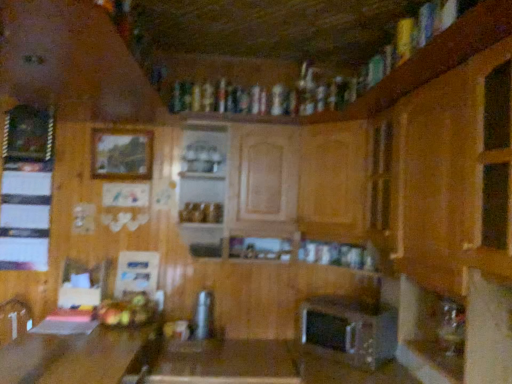
Question: Which direction should I rotate to look at wooden table at center, marked as the 1th table in a right-to-left arrangement, — up or down?

Choices:
 (A) down
 (B) up

Answer: (A)

Question: Is the surface of wooden picture frame at upper left, which is the second picture frame in left-to-right order, in direct contact with wooden table at lower left, which is the first table from left to right?

Choices:
 (A) no
 (B) yes

Answer: (A)

Question: Does wooden picture frame at upper left, which is the second picture frame in left-to-right order, turn towards wooden table at lower left, which ranks as the second table in right-to-left order?

Choices:
 (A) yes
 (B) no

Answer: (B)

Question: Can you confirm if wooden picture frame at upper left, the first picture frame in the right-to-left sequence, is shorter than wooden table at lower left, which is the first table from left to right?

Choices:
 (A) yes
 (B) no

Answer: (A)

Question: Does wooden picture frame at upper left, which is the second picture frame in left-to-right order, appear on the right side of wooden table at lower left, which ranks as the second table in right-to-left order?

Choices:
 (A) yes
 (B) no

Answer: (A)

Question: From the image's perspective, does wooden picture frame at upper left, the first picture frame in the right-to-left sequence, appear higher than wooden table at lower left, which is the first table from left to right?

Choices:
 (A) no
 (B) yes

Answer: (B)

Question: From a real-world perspective, is wooden picture frame at upper left, which is the second picture frame in left-to-right order, positioned over wooden table at lower left, which ranks as the second table in right-to-left order, based on gravity?

Choices:
 (A) yes
 (B) no

Answer: (A)

Question: Would you say satin silver toaster at lower center, marked as the 2th appliance in a left-to-right arrangement, contains metallic silver toaster at center, placed as the first appliance when sorted from left to right?

Choices:
 (A) no
 (B) yes

Answer: (A)

Question: Would you consider satin silver toaster at lower center, marked as the 2th appliance in a left-to-right arrangement, to be distant from metallic silver toaster at center, placed as the first appliance when sorted from left to right?

Choices:
 (A) no
 (B) yes

Answer: (A)

Question: Is satin silver toaster at lower center, positioned as the 1th appliance in right-to-left order, turned away from metallic silver toaster at center, which is the second appliance in right-to-left order?

Choices:
 (A) yes
 (B) no

Answer: (B)

Question: Is satin silver toaster at lower center, marked as the 2th appliance in a left-to-right arrangement, taller than metallic silver toaster at center, which is the second appliance in right-to-left order?

Choices:
 (A) yes
 (B) no

Answer: (A)

Question: From a real-world perspective, is satin silver toaster at lower center, marked as the 2th appliance in a left-to-right arrangement, beneath metallic silver toaster at center, which is the second appliance in right-to-left order?

Choices:
 (A) no
 (B) yes

Answer: (B)

Question: Does satin silver toaster at lower center, marked as the 2th appliance in a left-to-right arrangement, appear on the right side of metallic silver toaster at center, which is the second appliance in right-to-left order?

Choices:
 (A) no
 (B) yes

Answer: (B)

Question: From a real-world perspective, is wooden picture frame at upper left, which is the second picture frame in left-to-right order, physically above shiny metallic fruit basket at lower center?

Choices:
 (A) no
 (B) yes

Answer: (B)